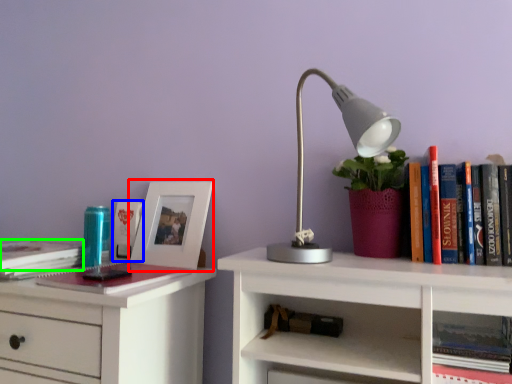
Question: Based on their relative distances, which object is farther from picture frame (highlighted by a red box)? Choose from book (highlighted by a blue box) and book (highlighted by a green box).

Choices:
 (A) book
 (B) book

Answer: (B)